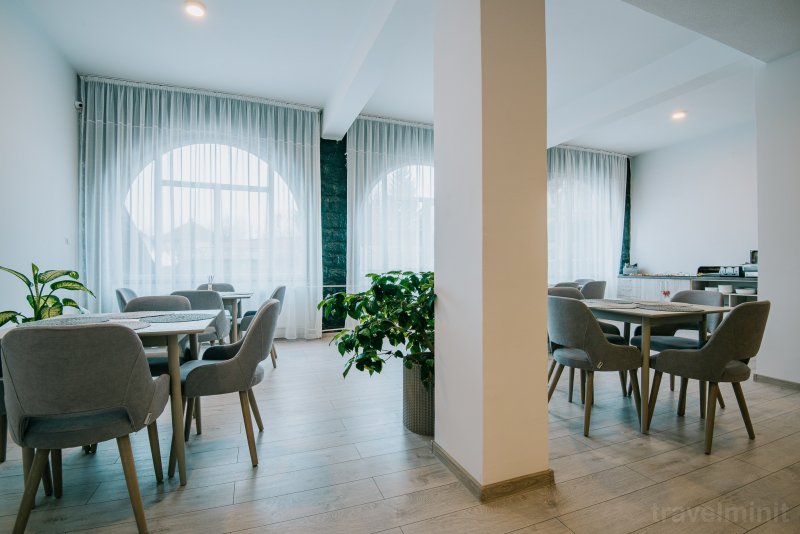
Find the location of a particular element. This screenshot has width=800, height=534. table is located at coordinates (193, 327), (232, 301), (554, 285), (633, 313).